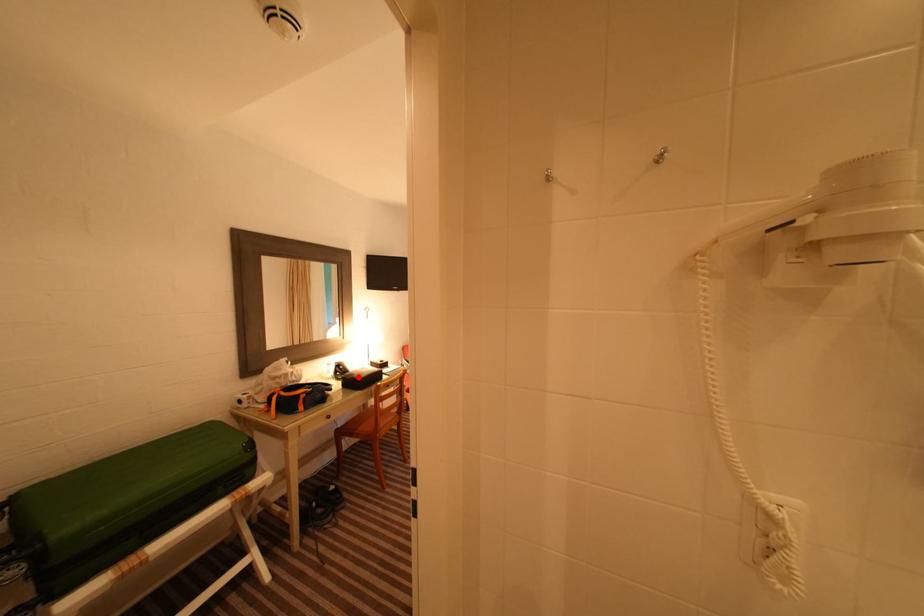
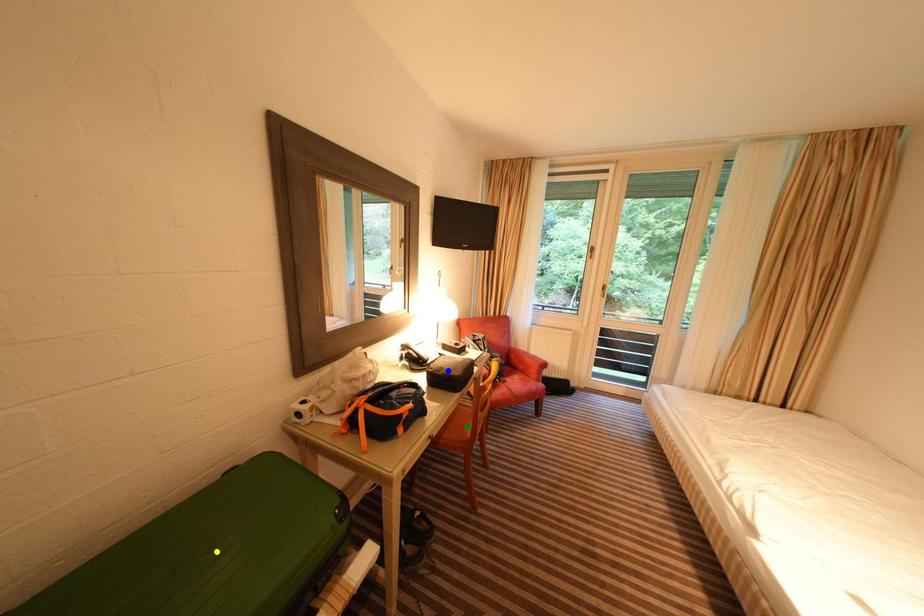
Question: I am providing you with two images of the same scene from different viewpoints. A red point is marked on the first image. You are given multiple points on the second image. Which point in image 2 represents the same 3d spot as the red point in image 1?

Choices:
 (A) yellow point
 (B) green point
 (C) blue point

Answer: (C)